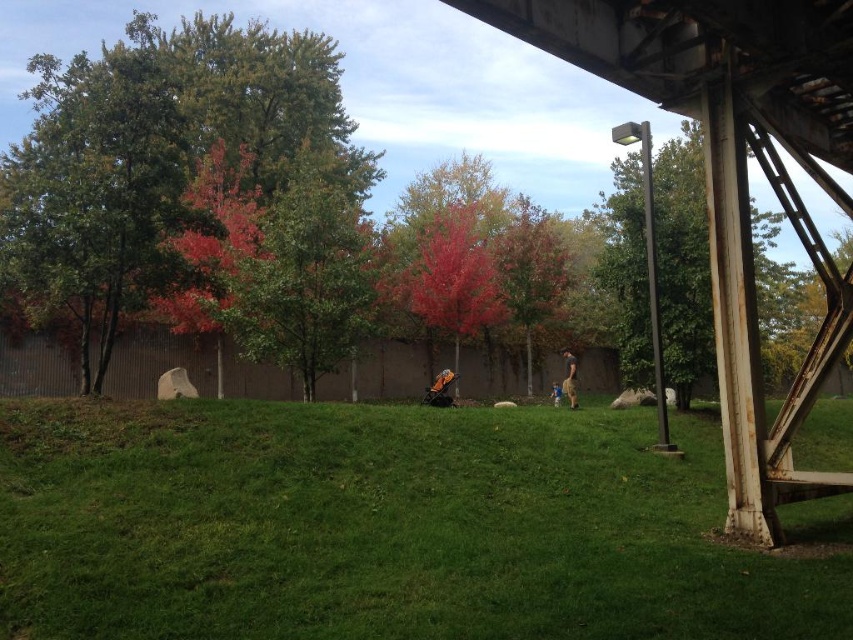
Question: Can you confirm if reddish-brown bark tree at center is positioned below blue jeans at center?

Choices:
 (A) no
 (B) yes

Answer: (A)

Question: Which point is closer to the camera taking this photo?

Choices:
 (A) (323, 54)
 (B) (527, 220)

Answer: (B)

Question: Does green grassy at lower center have a smaller size compared to green matte tree at center?

Choices:
 (A) no
 (B) yes

Answer: (B)

Question: Which is farther from the light brown leather jacket at center?

Choices:
 (A) green grassy at lower center
 (B) reddish-brown bark tree at center
 (C) blue jeans at center
 (D) green matte tree at center

Answer: (A)

Question: Can you confirm if vivid red bark tree at center is positioned to the left of reddish-brown bark tree at center?

Choices:
 (A) yes
 (B) no

Answer: (A)

Question: Among these points, which one is nearest to the camera?

Choices:
 (A) (601, 460)
 (B) (537, 314)
 (C) (550, 394)

Answer: (A)